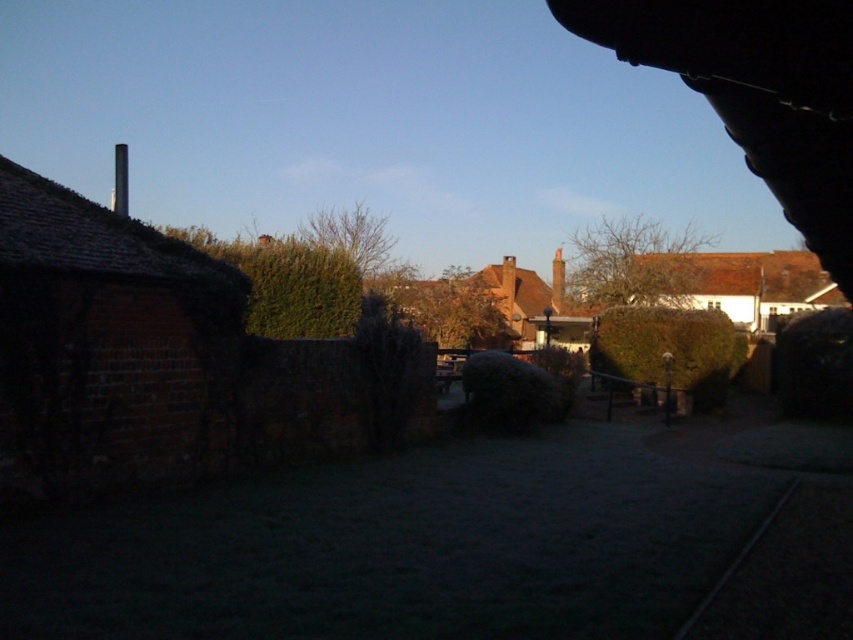
You are standing at the center of the image. Which direction should you look to see the smooth white chimney at upper left?

The smooth white chimney at upper left is located at point (120, 180), so you should look to the upper left direction to see it.

You are a photographer setting up equipment near the black metal train track at lower right and the smooth white chimney at upper left. You want to capture both objects in a single frame. Which object should you focus on first to ensure both are in the frame?

Since the black metal train track at lower right is not as tall as the smooth white chimney at upper left, you should focus on the smooth white chimney at upper left first to ensure both are in the frame.

You are a drone operator tasked with flying a drone over the scene. The drone has a height restriction of 3 meters. Can you fly the drone between the smooth white chimney at upper left and the orange clay chimney at center without hitting either?

The smooth white chimney at upper left is positioned over the orange clay chimney at center, meaning there is vertical overlap between them. Since the drone has a height restriction of 3 meters, it cannot safely navigate between them without risking collision.